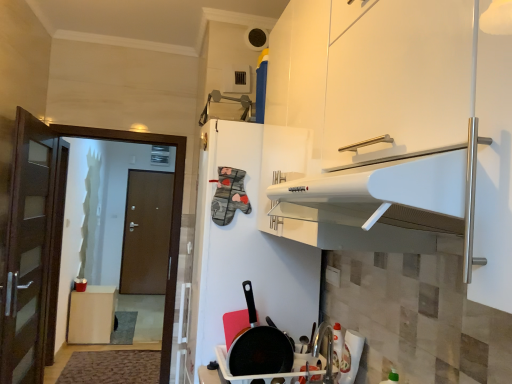
Identify the location of free point above brown wooden door at left (from a real-world perspective). The height and width of the screenshot is (384, 512). (113, 123).